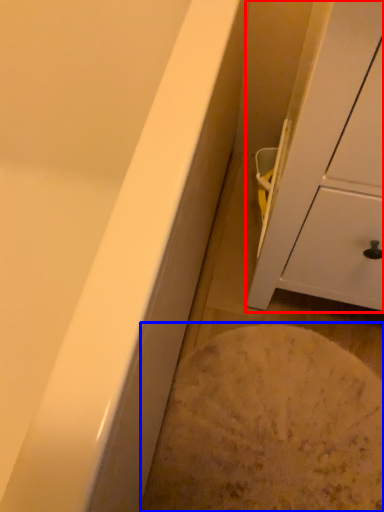
Question: Which object is further to the camera taking this photo, cabinetry (highlighted by a red box) or flour (highlighted by a blue box)?

Choices:
 (A) cabinetry
 (B) flour

Answer: (B)